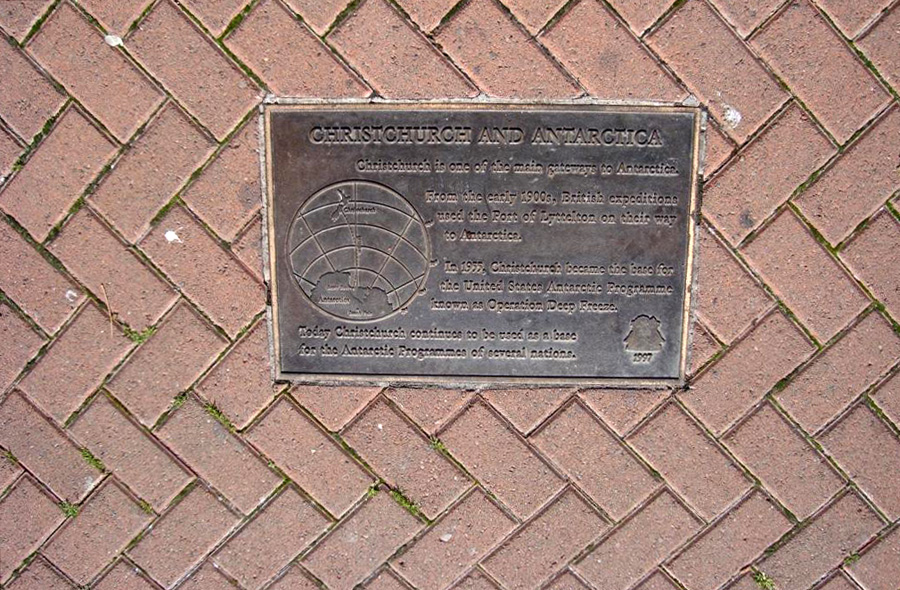
Identify the location of globe. This screenshot has width=900, height=590. (354, 250).